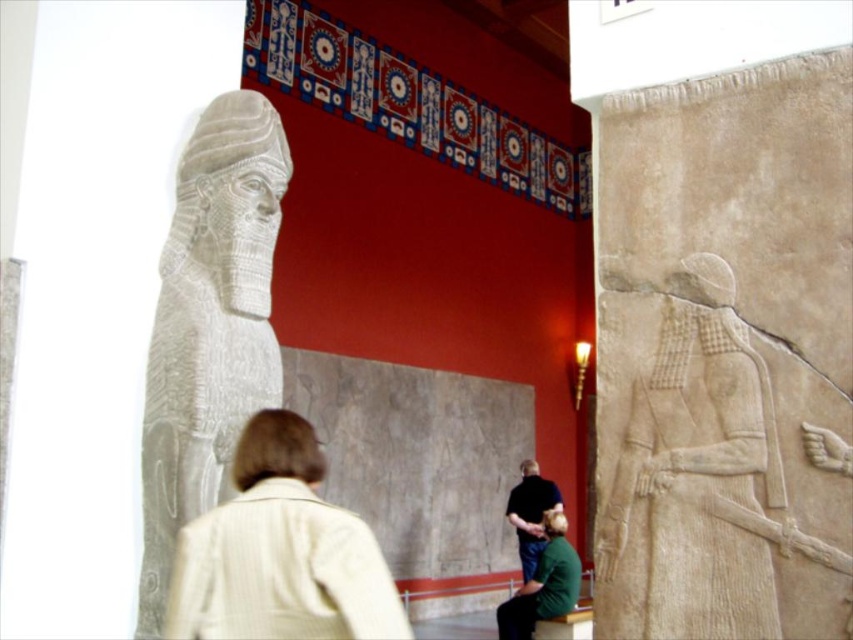
You are an archaeologist examining the museum layout. There are two points of interest marked in the scene. The first point is at coordinates point (604,608) and the second is at point (505,509). Which point is nearer to you as you stand in front of the museum display?

Point (604,608) is closer to the viewer than point (505,509) according to the description.

You are a visitor in the museum and want to take a photo of both the light beige jacket at center and the dark blue shirt at center. Since you can only focus on one object at a time, which one should you focus on to ensure the other is still in the background?

You should focus on the light beige jacket at center because it is closer to the viewer than the dark blue shirt at center, so focusing on it will keep the dark blue shirt at center in the background.